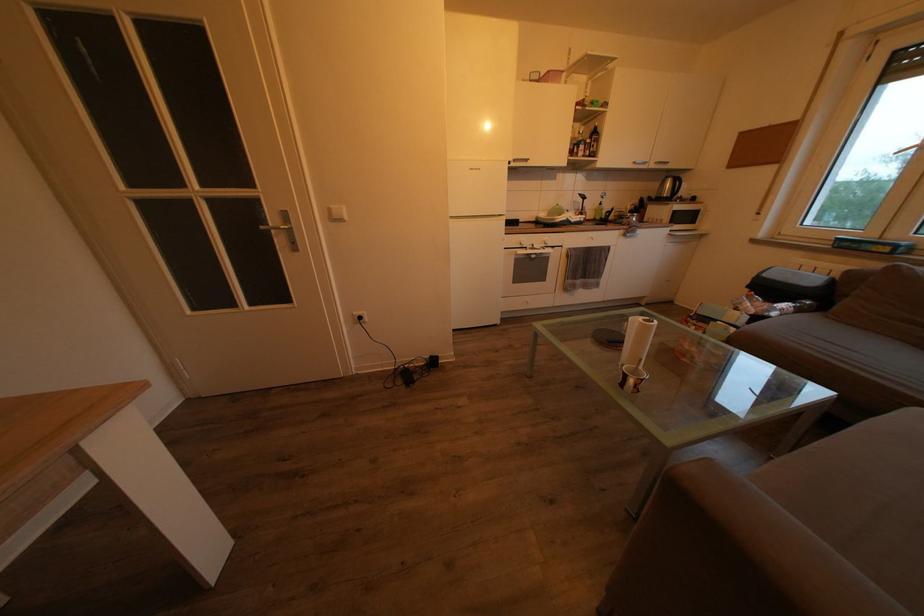
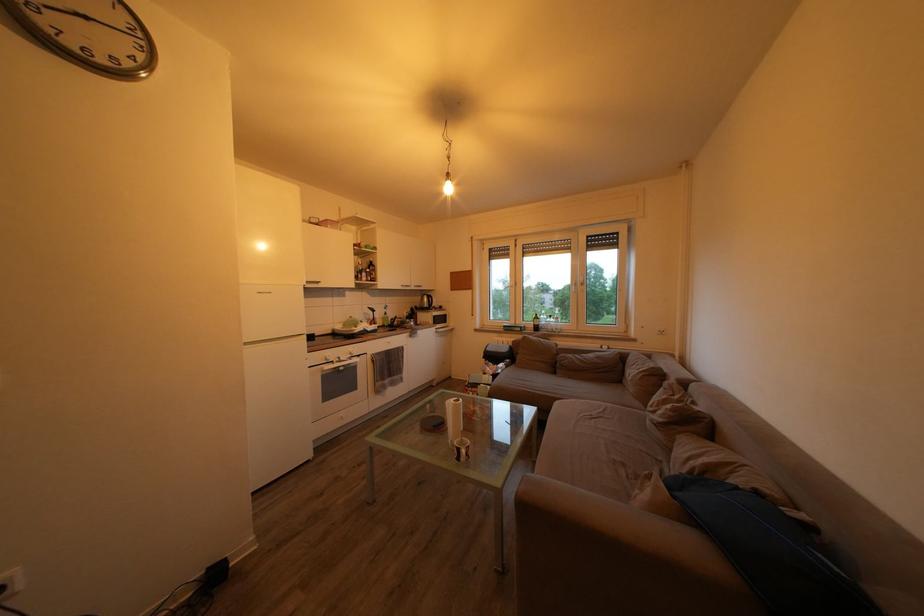
The point at (694, 224) is marked in the first image. Where is the corresponding point in the second image?

(448, 326)